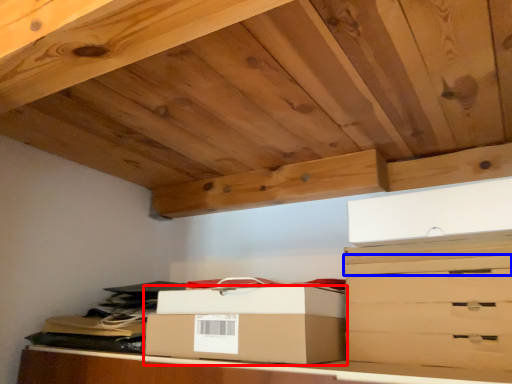
Question: Among these objects, which one is farthest to the camera, box (highlighted by a red box) or drawer (highlighted by a blue box)?

Choices:
 (A) box
 (B) drawer

Answer: (A)